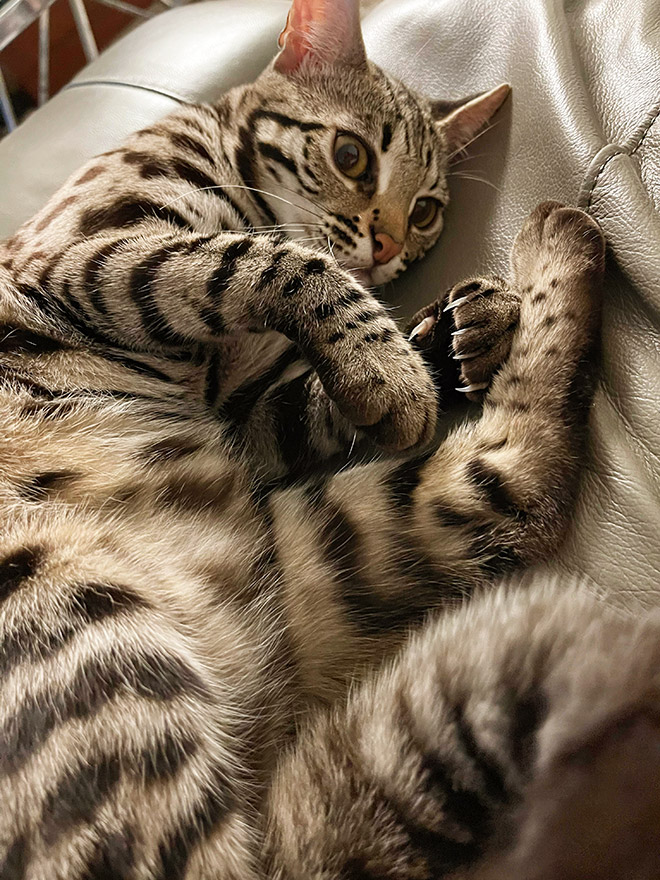
The width and height of the screenshot is (660, 880). Identify the location of leather furniture. (554, 122).